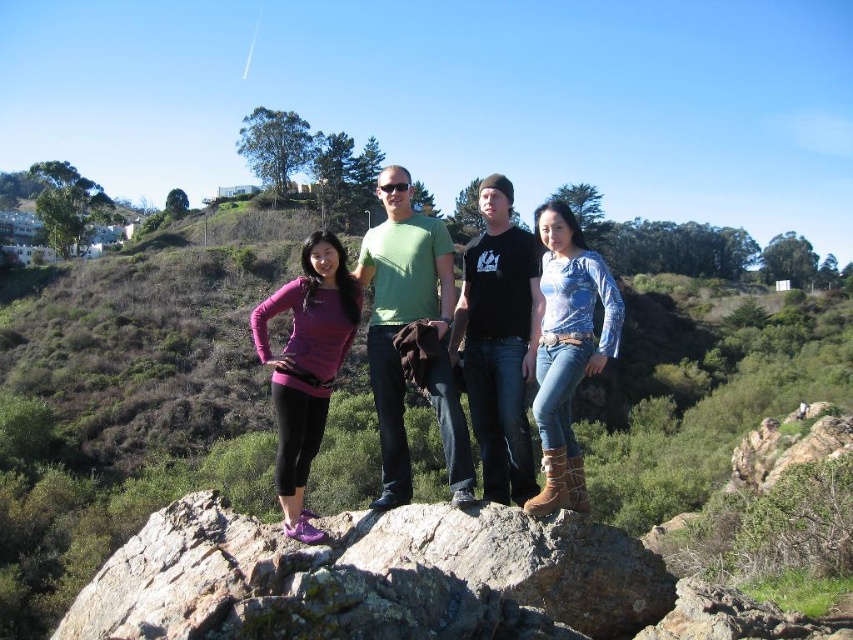
You are standing at the point with coordinates point [498,342]. You want to move towards the black cotton t shirt at center. Which direction should you move?

The point [498,342] is already at the location of the black cotton t shirt at center, so you are already there.